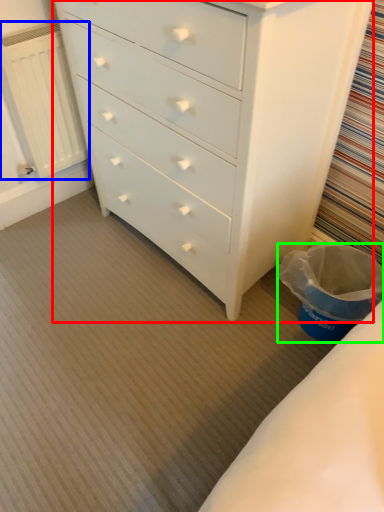
Question: Considering the real-world distances, which object is farthest from chest of drawers (highlighted by a red box)? radiator (highlighted by a blue box) or laundry basket (highlighted by a green box)?

Choices:
 (A) radiator
 (B) laundry basket

Answer: (A)